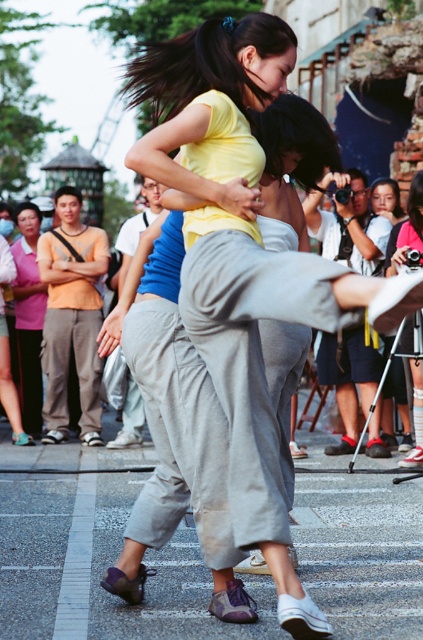
You are standing at the point with coordinates point (415,195) and want to watch the street performance happening at point (46,339). Is there a clear view from your current position to the performance?

Point (46,339) is behind point (415,195), so you cannot see the performance clearly from your current position because the point (415,195) is blocking the view.

You are a photographer standing at the edge of the crowd. You want to take a photo that includes both the orange cotton shirt at left and the matte pink shirt at center. Given that your camera has a maximum zoom range of 20 feet, will you be able to capture both shirts in the same frame without moving closer?

The orange cotton shirt at left and matte pink shirt at center are 22.12 feet apart from each other. Since the camera can only zoom up to 20 feet, the distance between them exceeds the maximum zoom range. Therefore, you will not be able to capture both shirts in the same frame without moving closer.

You are a photographer trying to capture the best angle of the two performers. You notice two specific points in the scene labeled as point (313, 304) and point (354, 259). Which of these points is positioned closer to your camera lens?

Point (313, 304) is closer to the viewer than point (354, 259), so the photographer should focus on that point to capture the closer one.